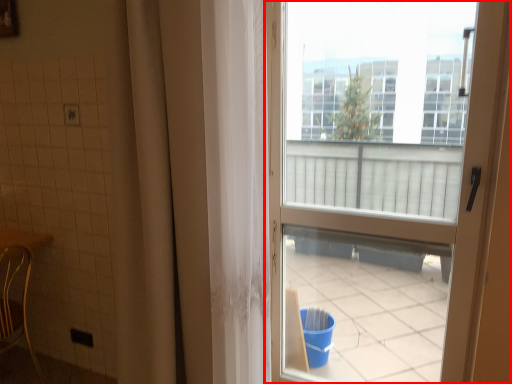
Question: From the image, what is the correct spatial relationship of door (annotated by the red box) in relation to chair?

Choices:
 (A) right
 (B) left

Answer: (A)